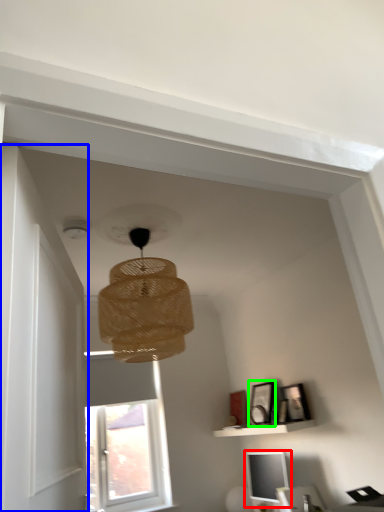
Question: Based on their relative distances, which object is farther from computer monitor (highlighted by a red box)? Choose from door (highlighted by a blue box) and picture frame (highlighted by a green box).

Choices:
 (A) door
 (B) picture frame

Answer: (A)